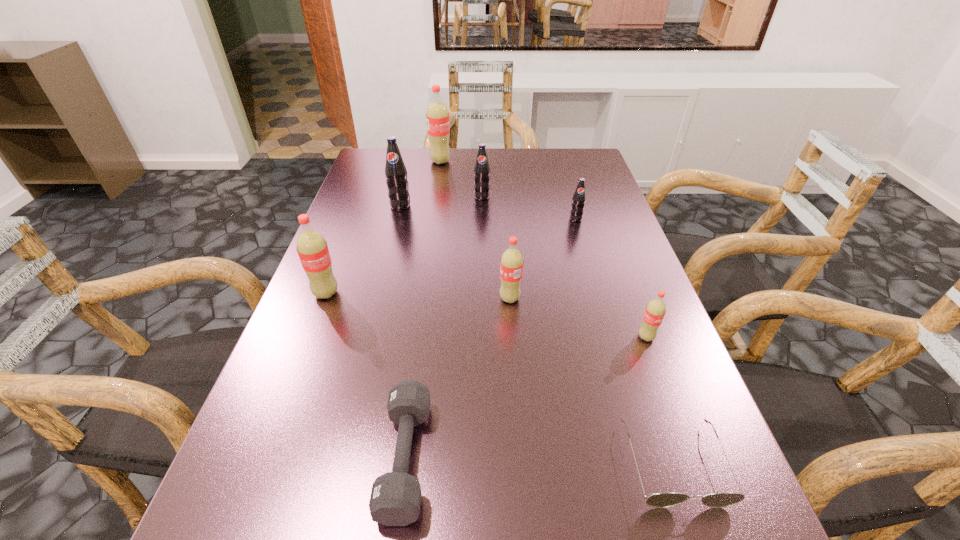
Where is `vacant region located 0.310m on the back of the leftmost object`? vacant region located 0.310m on the back of the leftmost object is located at coordinates (359, 208).

Locate an element on the screen. This screenshot has height=540, width=960. vacant position located on the front label of the second smallest black pop is located at coordinates (483, 288).

The height and width of the screenshot is (540, 960). What are the coordinates of `vacant region located 0.220m on the front of the second smallest red soda` in the screenshot? It's located at (517, 398).

Where is `free region located 0.250m on the front label of the rightmost black pop`? Image resolution: width=960 pixels, height=540 pixels. free region located 0.250m on the front label of the rightmost black pop is located at coordinates (596, 287).

Identify the location of vacant area located on the front of the rightmost soda. The height and width of the screenshot is (540, 960). (679, 426).

Image resolution: width=960 pixels, height=540 pixels. What are the coordinates of `vacant space located on the back of the dumbbell` in the screenshot? It's located at (420, 343).

Locate an element on the screen. The image size is (960, 540). object that is at the far edge is located at coordinates (437, 116).

Identify the location of sunglasses located in the right edge section of the desktop. The image size is (960, 540). (666, 499).

In the image, there is a desktop. Where is `vacant region at the far edge`? This screenshot has height=540, width=960. vacant region at the far edge is located at coordinates (527, 156).

Locate an element on the screen. The height and width of the screenshot is (540, 960). vacant space at the left edge of the desktop is located at coordinates (304, 398).